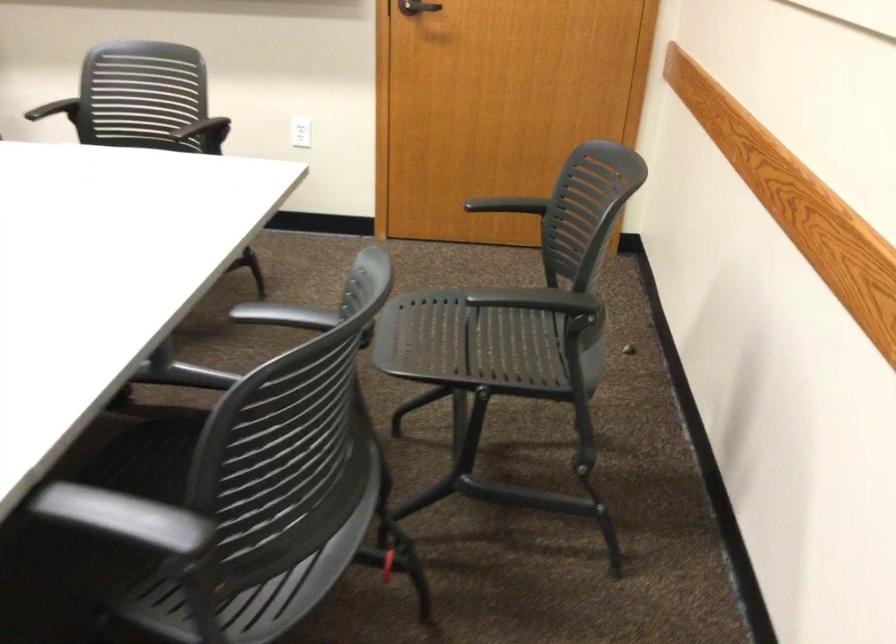
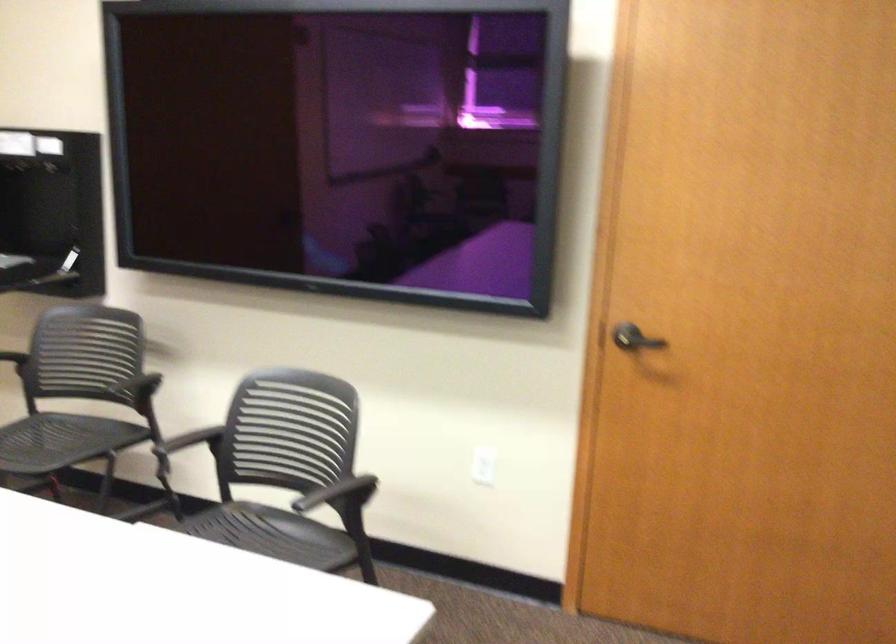
First-person continuous shooting, in which direction is the camera rotating?

The camera rotated toward left-up.